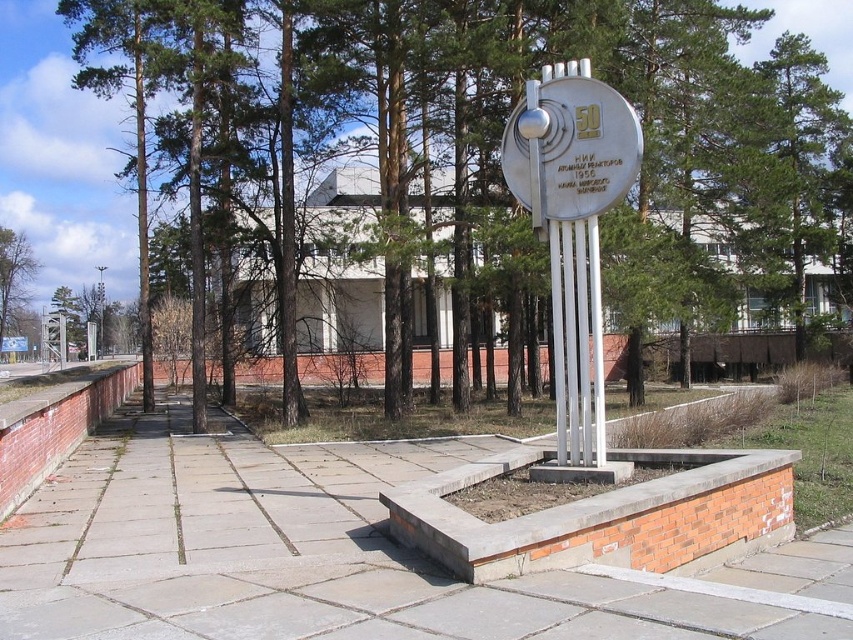
Between point (595, 579) and point (436, 376), which one is positioned in front?

Positioned in front is point (595, 579).

Is gray concrete pavement at center further to camera compared to green leafy tree at center?

That is False.

The width and height of the screenshot is (853, 640). What are the coordinates of `gray concrete pavement at center` in the screenshot? It's located at (335, 554).

Does gray concrete pavement at center appear on the left side of green leafy tree at left?

Incorrect, gray concrete pavement at center is not on the left side of green leafy tree at left.

Is gray concrete pavement at center smaller than green leafy tree at left?

Yes, gray concrete pavement at center is smaller than green leafy tree at left.

The width and height of the screenshot is (853, 640). I want to click on gray concrete pavement at center, so click(x=335, y=554).

Is point (196, 38) closer to viewer compared to point (22, 285)?

Yes, it is in front of point (22, 285).

Which is more to the right, green leafy tree at center or green leafy tree at left?

Positioned to the right is green leafy tree at center.

Locate an element on the screen. green leafy tree at center is located at coordinates (141, 193).